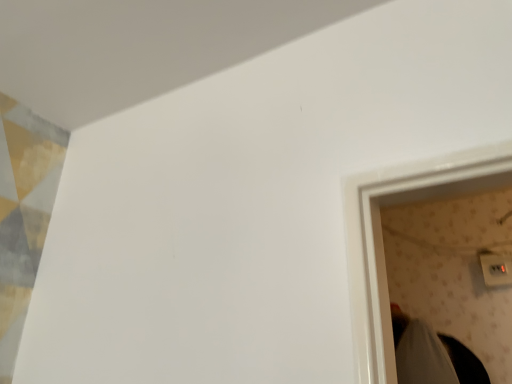
Based on the photo, what is the approximate width of white plastic electric outlet at upper right?

It is 2.87 inches.

Where is `white plastic electric outlet at upper right`? The width and height of the screenshot is (512, 384). white plastic electric outlet at upper right is located at coordinates pyautogui.click(x=496, y=269).

This screenshot has width=512, height=384. Describe the element at coordinates (496, 269) in the screenshot. I see `white plastic electric outlet at upper right` at that location.

Locate an element on the screen. This screenshot has width=512, height=384. white plastic electric outlet at upper right is located at coordinates (496, 269).